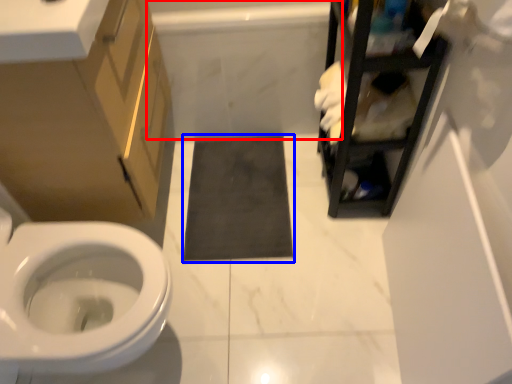
Question: Which object is further to the camera taking this photo, bath (highlighted by a red box) or bath mat (highlighted by a blue box)?

Choices:
 (A) bath
 (B) bath mat

Answer: (B)